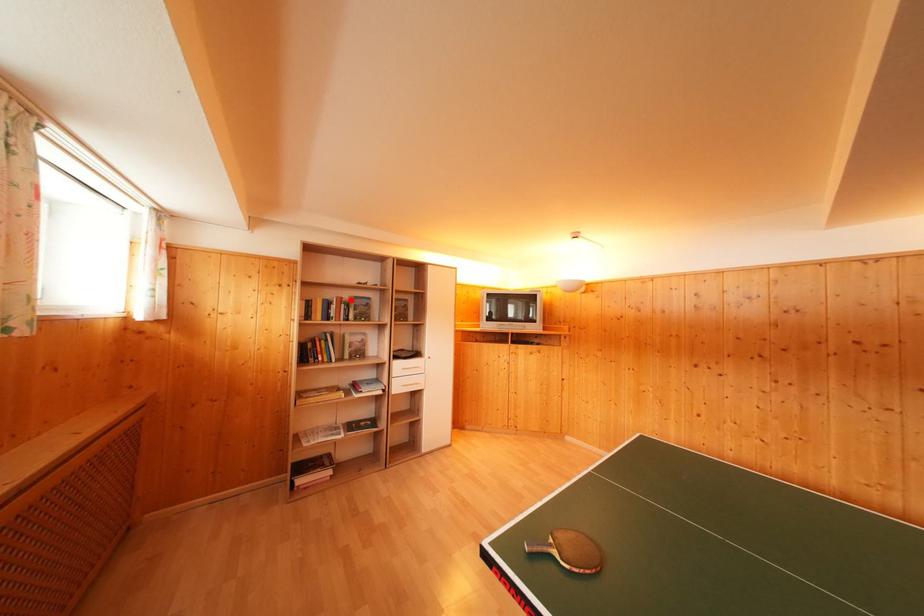
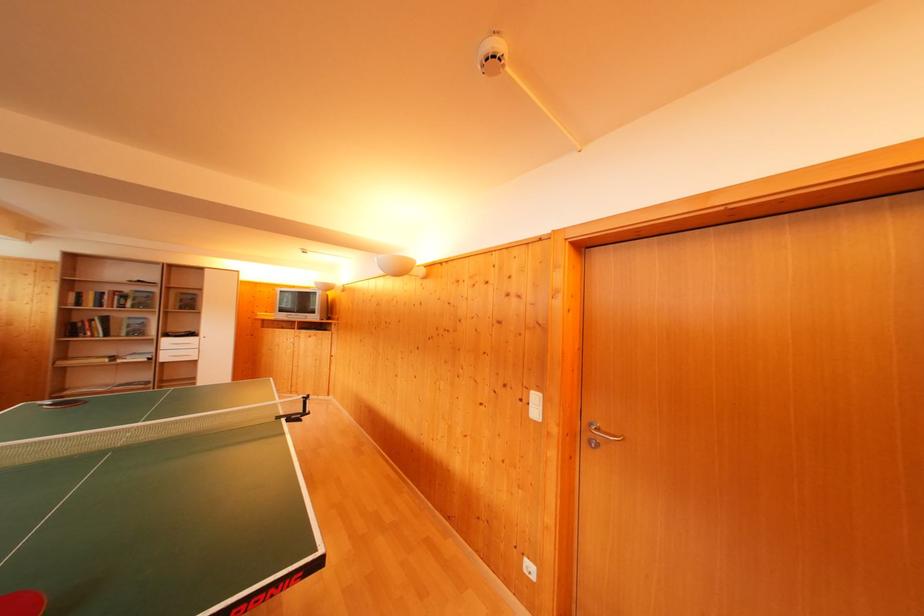
Where in the second image is the point corresponding to the highlighted location from the first image?

(131, 294)